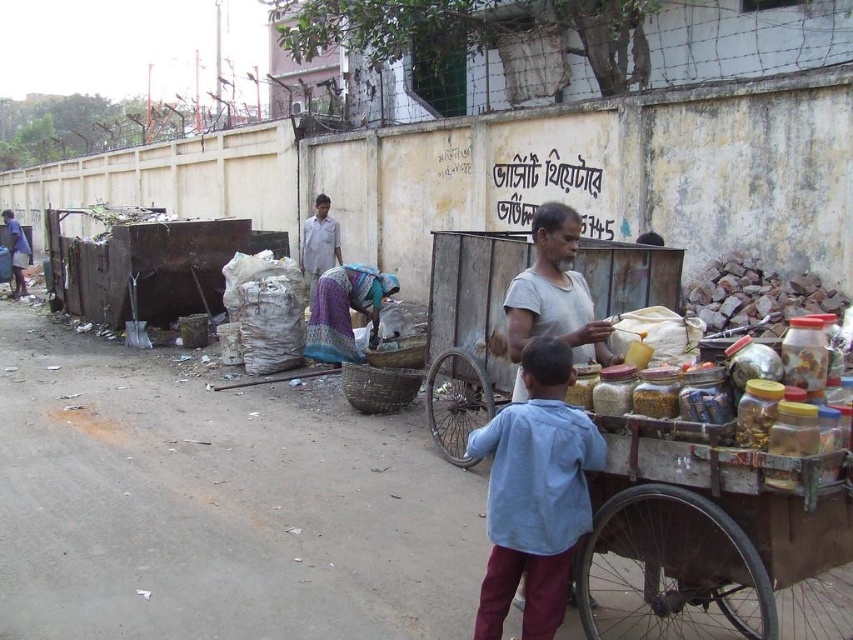
Which of these two, wooden cart at center or printed fabric basket at center, stands taller?

wooden cart at center is taller.

Consider the image. Measure the distance between wooden cart at center and camera.

8.43 feet

This screenshot has width=853, height=640. Describe the element at coordinates (724, 522) in the screenshot. I see `wooden cart at center` at that location.

Locate an element on the screen. The width and height of the screenshot is (853, 640). wooden cart at center is located at coordinates (724, 522).

Can you confirm if wooden cart at center is taller than light blue fabric shirt at center?

No, wooden cart at center is not taller than light blue fabric shirt at center.

Between wooden cart at center and light blue fabric shirt at center, which one has more height?

With more height is light blue fabric shirt at center.

Does point (676, 285) come in front of point (505, 582)?

No, (676, 285) is further to viewer.

This screenshot has height=640, width=853. I want to click on wooden cart at center, so click(724, 522).

Does wooden cart at center appear under gray cotton shirt at center?

Correct, wooden cart at center is located below gray cotton shirt at center.

Is wooden cart at center further to the viewer compared to gray cotton shirt at center?

No, it is not.

The height and width of the screenshot is (640, 853). What are the coordinates of `wooden cart at center` in the screenshot? It's located at (724, 522).